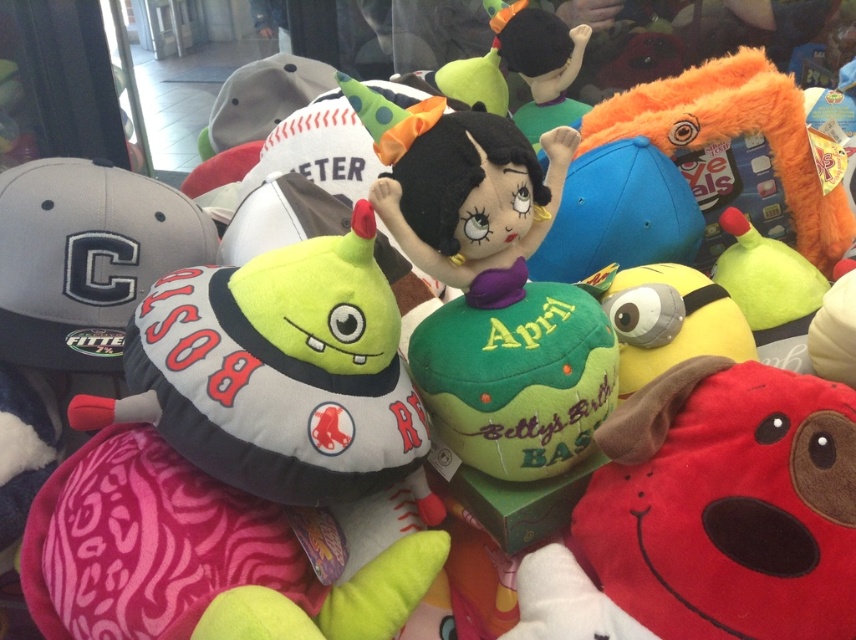
Question: Which object is farther from the camera taking this photo?

Choices:
 (A) velvet plush toy at center
 (B) gray fabric baseball cap at left

Answer: (B)

Question: Among these points, which one is nearest to the camera?

Choices:
 (A) (253, 112)
 (B) (480, 237)
 (C) (40, 227)

Answer: (B)

Question: Can you confirm if gray fabric baseball cap at left is wider than velvet plush toy at center?

Choices:
 (A) yes
 (B) no

Answer: (B)

Question: Is gray fabric baseball cap at left above velvet plush toy at center?

Choices:
 (A) no
 (B) yes

Answer: (A)

Question: Among these points, which one is farthest from the camera?

Choices:
 (A) pyautogui.click(x=414, y=234)
 (B) pyautogui.click(x=68, y=358)
 (C) pyautogui.click(x=263, y=84)

Answer: (C)

Question: Is gray fabric baseball cap at left below gray fabric baseball cap at upper left?

Choices:
 (A) yes
 (B) no

Answer: (A)